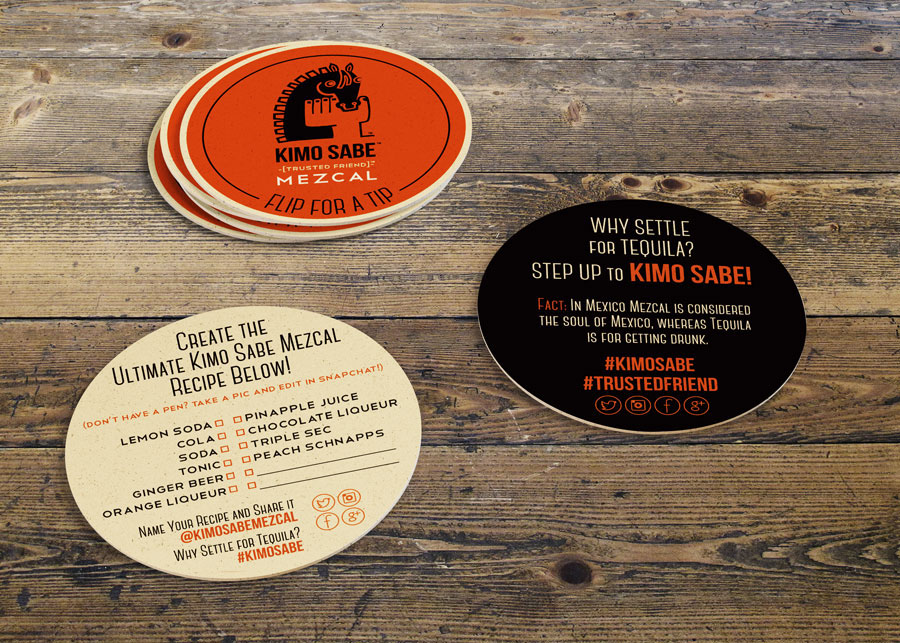
I want to click on woodgrain plank, so click(644, 550), click(833, 376), click(846, 251), click(796, 121), click(784, 26).